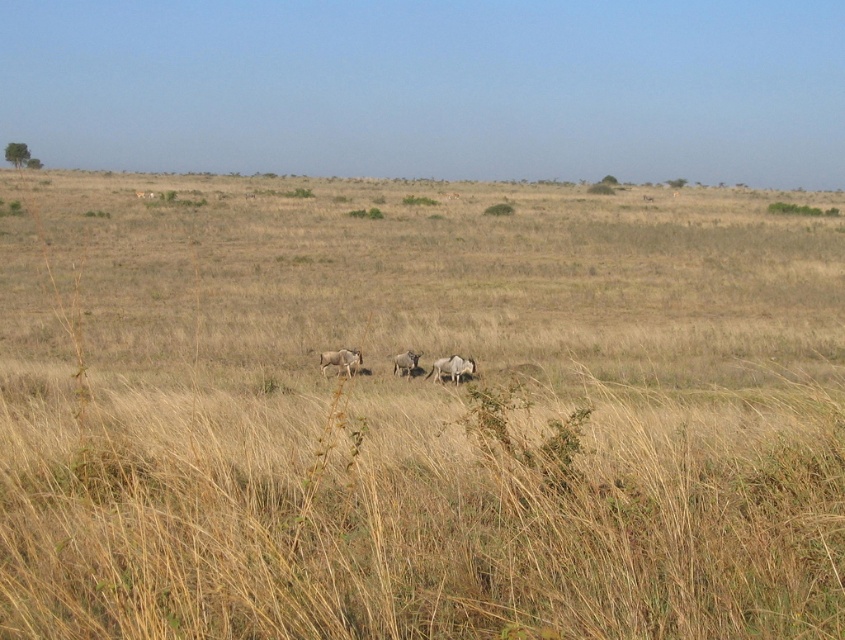
Question: Which is nearer to the grayish-brown fur antelope at center?

Choices:
 (A) grayish-brown fur at center
 (B) dry grass at center

Answer: (A)

Question: Is dry grass at center above grayish-brown fur antelope at center?

Choices:
 (A) yes
 (B) no

Answer: (A)

Question: Based on their relative distances, which object is nearer to the grayish-brown fur antelope at center?

Choices:
 (A) grayish-brown fur at center
 (B) grayish-brown fur zebra at center
 (C) dry grass at center

Answer: (B)

Question: Among these objects, which one is nearest to the camera?

Choices:
 (A) grayish-brown fur zebra at center
 (B) dry grass at center
 (C) grayish-brown fur at center
 (D) grayish-brown fur antelope at center

Answer: (B)

Question: Can you confirm if dry grass at center is positioned to the left of grayish-brown fur zebra at center?

Choices:
 (A) yes
 (B) no

Answer: (A)

Question: Can you confirm if dry grass at center is smaller than grayish-brown fur antelope at center?

Choices:
 (A) yes
 (B) no

Answer: (B)